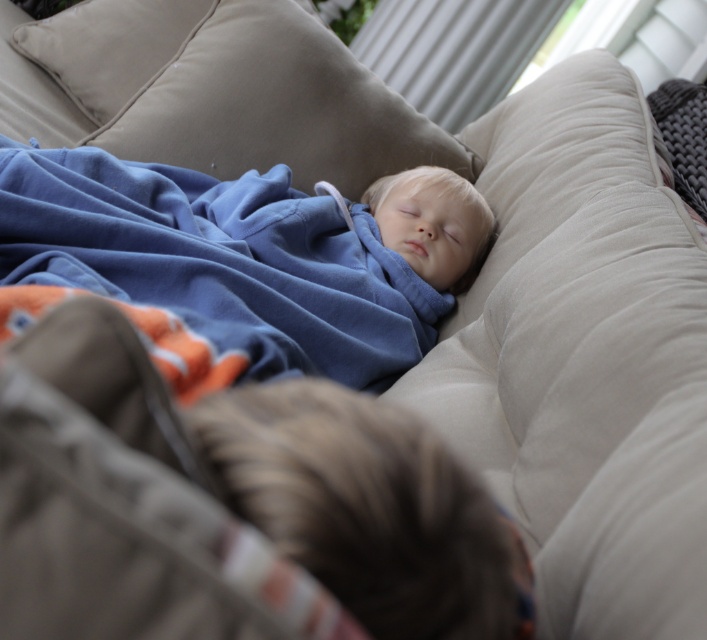
Is blue fleece blanket at upper center shorter than beige velvety pillow at upper left?

No, blue fleece blanket at upper center is not shorter than beige velvety pillow at upper left.

Between blue fleece blanket at upper center and beige velvety pillow at upper left, which one has more height?

Standing taller between the two is blue fleece blanket at upper center.

Between point (378, 353) and point (117, 44), which one is positioned in front?

Point (378, 353) is in front.

Locate an element on the screen. This screenshot has width=707, height=640. blue fleece blanket at upper center is located at coordinates (251, 253).

How much distance is there between fluffy brown hair at center and beige velvety pillow at upper left?

The distance of fluffy brown hair at center from beige velvety pillow at upper left is 4.45 feet.

What are the coordinates of `fluffy brown hair at center` in the screenshot? It's located at (x=368, y=508).

Identify the location of fluffy brown hair at center. (368, 508).

Does fluffy brown hair at center have a greater height compared to beige fabric pillow at upper center?

No.

This screenshot has width=707, height=640. In order to click on fluffy brown hair at center in this screenshot , I will do `click(368, 508)`.